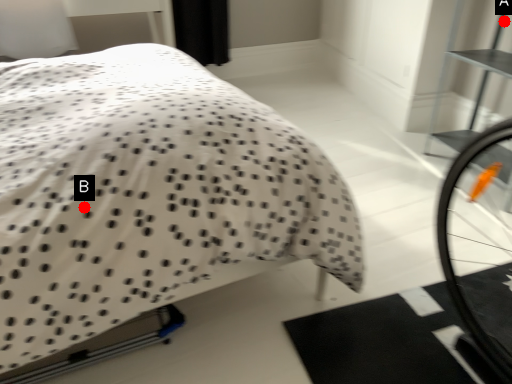
Question: Two points are circled on the image, labeled by A and B beside each circle. Which of the following is the closest to the observer?

Choices:
 (A) A is closer
 (B) B is closer

Answer: (B)